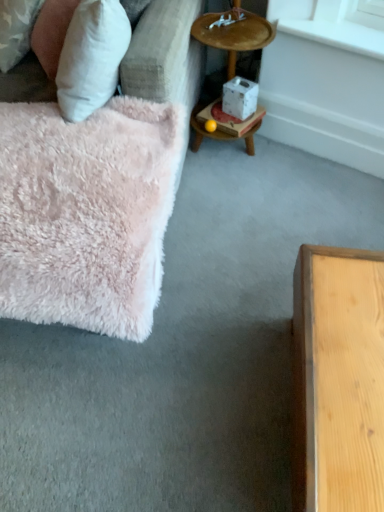
Find the location of a particular element. Image resolution: width=384 pixels, height=512 pixels. wooden tray at upper right is located at coordinates (235, 34).

Image resolution: width=384 pixels, height=512 pixels. Find the location of `white cardboard box at center`. white cardboard box at center is located at coordinates (224, 126).

Find the location of `fluffy pink rug at left`. fluffy pink rug at left is located at coordinates (99, 188).

Looking at this image, are white smooth window sill at upper right and white fluffy pillow at upper left far apart?

That's not correct — white smooth window sill at upper right is a little close to white fluffy pillow at upper left.

Is white smooth window sill at upper right not within white fluffy pillow at upper left?

white smooth window sill at upper right lies outside white fluffy pillow at upper left's area.

Considering the relative sizes of white smooth window sill at upper right and white fluffy pillow at upper left in the image provided, is white smooth window sill at upper right smaller than white fluffy pillow at upper left?

Yes, white smooth window sill at upper right is smaller than white fluffy pillow at upper left.

How many degrees apart are the facing directions of white smooth window sill at upper right and white fluffy pillow at upper left?

51.7 degrees separate the facing orientations of white smooth window sill at upper right and white fluffy pillow at upper left.

Between fluffy pink rug at left and white fluffy pillow at upper left, which one has smaller width?

Thinner between the two is white fluffy pillow at upper left.

Is fluffy pink rug at left in front of white fluffy pillow at upper left?

Yes, it is in front of white fluffy pillow at upper left.

Is white fluffy pillow at upper left at the back of fluffy pink rug at left?

Yes, fluffy pink rug at left is positioned with its back facing white fluffy pillow at upper left.

Are fluffy pink rug at left and white fluffy pillow at upper left located far from each other?

No, fluffy pink rug at left is not far away from white fluffy pillow at upper left.

From the image's perspective, is fluffy pink rug at left located beneath wooden tray at upper right?

Yes.

Does fluffy pink rug at left appear on the right side of wooden tray at upper right?

No, fluffy pink rug at left is not to the right of wooden tray at upper right.

Considering the positions of point (16, 309) and point (234, 58), is point (16, 309) closer or farther from the camera than point (234, 58)?

Point (16, 309) appears to be closer to the viewer than point (234, 58).

Based on the photo, can you confirm if fluffy pink rug at left is smaller than wooden tray at upper right?

No.

In terms of width, does white smooth window sill at upper right look wider or thinner when compared to fluffy pink rug at left?

white smooth window sill at upper right is thinner than fluffy pink rug at left.

Could you tell me if white smooth window sill at upper right is turned towards fluffy pink rug at left?

Yes, white smooth window sill at upper right faces towards fluffy pink rug at left.

Is white smooth window sill at upper right positioned beyond the bounds of fluffy pink rug at left?

Yes, white smooth window sill at upper right is not within fluffy pink rug at left.

At what (x,y) coordinates should I click in order to perform the action: click on window sill located above the fluffy pink rug at left (from a real-world perspective). Please return your answer as a coordinate pair (x, y). Image resolution: width=384 pixels, height=512 pixels. Looking at the image, I should click on (334, 23).

Which of these two, white smooth window sill at upper right or wooden tray at upper right, is thinner?

Thinner between the two is white smooth window sill at upper right.

In the scene shown: Visually, is white smooth window sill at upper right positioned to the left or to the right of wooden tray at upper right?

In the image, white smooth window sill at upper right appears on the right side of wooden tray at upper right.

Find the location of a particular element. The width and height of the screenshot is (384, 512). window sill above the wooden tray at upper right (from a real-world perspective) is located at coordinates (334, 23).

Considering the relative sizes of white smooth window sill at upper right and wooden tray at upper right in the image provided, is white smooth window sill at upper right shorter than wooden tray at upper right?

Correct, white smooth window sill at upper right is not as tall as wooden tray at upper right.

How different are the orientations of white cardboard box at center and white fluffy pillow at upper left in degrees?

56.5 degrees.

Is white cardboard box at center facing away from white fluffy pillow at upper left?

No.

From a real-world perspective, is white cardboard box at center physically below white fluffy pillow at upper left?

Yes, from a real-world perspective, white cardboard box at center is under white fluffy pillow at upper left.

From the picture: Which object is more forward, white cardboard box at center or white fluffy pillow at upper left?

Positioned in front is white fluffy pillow at upper left.

From the image's perspective, is white cardboard box at center above wooden tray at upper right?

No, from the image's perspective, white cardboard box at center is not on top of wooden tray at upper right.

Is the depth of white cardboard box at center greater than that of wooden tray at upper right?

Yes, white cardboard box at center is further from the viewer.

Which object is positioned more to the left, white cardboard box at center or wooden tray at upper right?

From the viewer's perspective, wooden tray at upper right appears more on the left side.

Find the location of a particular element. This screenshot has width=384, height=512. window sill below the white fluffy pillow at upper left (from the image's perspective) is located at coordinates (334, 23).

Image resolution: width=384 pixels, height=512 pixels. Identify the location of pillow to the left of fluffy pink rug at left. (51, 33).

Based on their spatial positions, is white cardboard box at center or white smooth window sill at upper right further from white fluffy pillow at upper left?

white smooth window sill at upper right.

When comparing their distances from white smooth window sill at upper right, does fluffy pink rug at left or white cardboard box at center seem further?

fluffy pink rug at left is positioned further to the anchor white smooth window sill at upper right.

Considering their positions, is white cardboard box at center positioned closer to fluffy pink rug at left than wooden tray at upper right?

wooden tray at upper right.

Estimate the real-world distances between objects in this image. Which object is further from white fluffy pillow at upper left, wooden tray at upper right or white cardboard box at center?

white cardboard box at center lies further to white fluffy pillow at upper left than the other object.

When comparing their distances from white smooth window sill at upper right, does wooden tray at upper right or fluffy pink rug at left seem further?

fluffy pink rug at left is positioned further to the anchor white smooth window sill at upper right.

Based on their spatial positions, is white fluffy pillow at upper left or white cardboard box at center further from fluffy pink rug at left?

Based on the image, white cardboard box at center appears to be further to fluffy pink rug at left.

Looking at the image, which one is located closer to wooden tray at upper right, white cardboard box at center or white smooth window sill at upper right?

white cardboard box at center lies closer to wooden tray at upper right than the other object.

Considering their positions, is white smooth window sill at upper right positioned further to wooden tray at upper right than white fluffy pillow at upper left?

Based on the image, white fluffy pillow at upper left appears to be further to wooden tray at upper right.

Identify the location of cocktail table situated between white fluffy pillow at upper left and white cardboard box at center from left to right. (235, 34).

The width and height of the screenshot is (384, 512). In order to click on table situated between fluffy pink rug at left and white smooth window sill at upper right from left to right in this screenshot , I will do `click(224, 126)`.

Locate an element on the screen. table between wooden tray at upper right and white smooth window sill at upper right from left to right is located at coordinates (224, 126).

At what (x,y) coordinates should I click in order to perform the action: click on cocktail table situated between fluffy pink rug at left and white smooth window sill at upper right from left to right. Please return your answer as a coordinate pair (x, y). Looking at the image, I should click on coord(235,34).